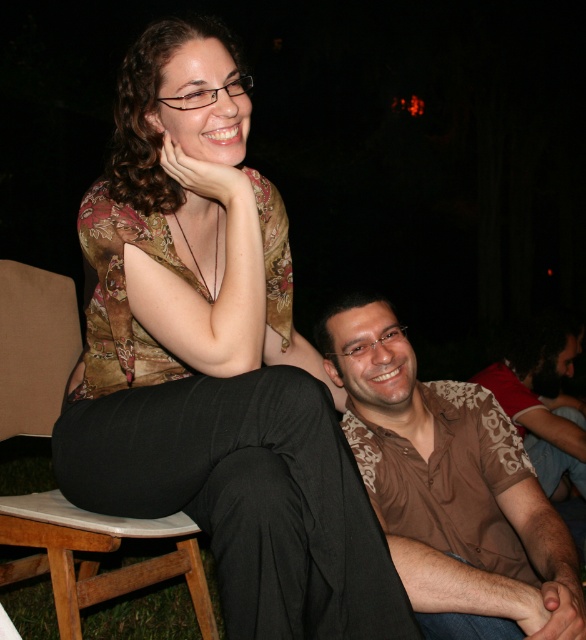
From the picture: You are a photographer trying to capture a candid shot of two people wearing brown shirts. You notice the brown printed shirt at center and the brown patterned shirt at lower right. Which shirt should you focus on if you want to include both in the frame without cropping either?

The brown printed shirt at center has a lesser height compared to brown patterned shirt at lower right. Therefore, you should focus on the brown patterned shirt at lower right since it is taller and will require more space in the frame to avoid cropping.

You are a photographer trying to capture a closeup of the person wearing the brown printed shirt at center and the brown patterned shirt at lower right. Which shirt will appear larger in your photo?

The brown printed shirt at center will appear larger in the photo because it is closer to the viewer than the brown patterned shirt at lower right.